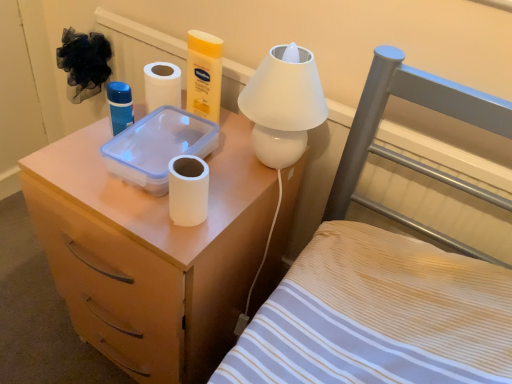
Question: Is the position of white matte toilet paper at center more distant than that of wooden nightstand at center-left?

Choices:
 (A) yes
 (B) no

Answer: (B)

Question: Is white matte toilet paper at center facing away from wooden nightstand at center-left?

Choices:
 (A) yes
 (B) no

Answer: (A)

Question: Does white matte toilet paper at center appear on the left side of wooden nightstand at center-left?

Choices:
 (A) no
 (B) yes

Answer: (B)

Question: Does white matte toilet paper at center lie in front of wooden nightstand at center-left?

Choices:
 (A) yes
 (B) no

Answer: (A)

Question: Can you confirm if white matte toilet paper at center is wider than wooden nightstand at center-left?

Choices:
 (A) no
 (B) yes

Answer: (A)

Question: Considering their positions, is matte plastic container at upper center located in front of or behind white matte toilet paper at center?

Choices:
 (A) front
 (B) behind

Answer: (A)

Question: In the image, is matte plastic container at upper center on the left side or the right side of white matte toilet paper at center?

Choices:
 (A) left
 (B) right

Answer: (A)

Question: In terms of width, does matte plastic container at upper center look wider or thinner when compared to white matte toilet paper at center?

Choices:
 (A) wide
 (B) thin

Answer: (A)

Question: Is matte plastic container at upper center spatially inside white matte toilet paper at center, or outside of it?

Choices:
 (A) inside
 (B) outside

Answer: (B)

Question: Based on their sizes in the image, would you say white matte toilet paper at center is bigger or smaller than matte plastic container at upper center?

Choices:
 (A) small
 (B) big

Answer: (A)

Question: Is point (199, 198) closer or farther from the camera than point (189, 304)?

Choices:
 (A) farther
 (B) closer

Answer: (B)

Question: From a real-world perspective, relative to matte plastic container at upper center, is white matte toilet paper at center vertically above or below?

Choices:
 (A) below
 (B) above

Answer: (B)

Question: Relative to matte plastic container at upper center, is white matte toilet paper at center in front or behind?

Choices:
 (A) behind
 (B) front

Answer: (A)

Question: Is wooden nightstand at center-left wider or thinner than white matte toilet paper at center?

Choices:
 (A) wide
 (B) thin

Answer: (A)

Question: Would you say wooden nightstand at center-left is inside or outside white matte toilet paper at center?

Choices:
 (A) outside
 (B) inside

Answer: (A)